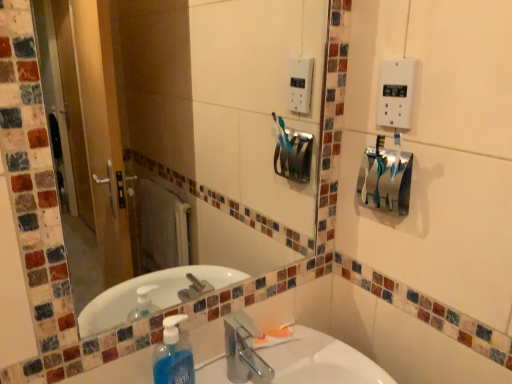
Question: Is white glossy sink at lower center further to the viewer compared to translucent orange tube at sink?

Choices:
 (A) yes
 (B) no

Answer: (B)

Question: Is white glossy sink at lower center oriented towards translucent orange tube at sink?

Choices:
 (A) yes
 (B) no

Answer: (B)

Question: Is white glossy sink at lower center positioned in front of translucent orange tube at sink?

Choices:
 (A) yes
 (B) no

Answer: (A)

Question: From the image's perspective, does white glossy sink at lower center appear higher than translucent orange tube at sink?

Choices:
 (A) yes
 (B) no

Answer: (B)

Question: Is white glossy sink at lower center looking in the opposite direction of translucent orange tube at sink?

Choices:
 (A) yes
 (B) no

Answer: (A)

Question: Is blue translucent liquid soap at lower left bigger or smaller than white plastic light switch at upper right?

Choices:
 (A) big
 (B) small

Answer: (A)

Question: From a real-world perspective, is blue translucent liquid soap at lower left above or below white plastic light switch at upper right?

Choices:
 (A) above
 (B) below

Answer: (B)

Question: From the image's perspective, is blue translucent liquid soap at lower left located above or below white plastic light switch at upper right?

Choices:
 (A) above
 (B) below

Answer: (B)

Question: Is point (182, 314) closer or farther from the camera than point (403, 61)?

Choices:
 (A) farther
 (B) closer

Answer: (A)

Question: Is clear glass mirror at upper center situated inside white plastic light switch at upper right or outside?

Choices:
 (A) inside
 (B) outside

Answer: (B)

Question: Does point (175, 144) appear closer or farther from the camera than point (395, 99)?

Choices:
 (A) closer
 (B) farther

Answer: (B)

Question: From a real-world perspective, relative to white plastic light switch at upper right, is clear glass mirror at upper center vertically above or below?

Choices:
 (A) above
 (B) below

Answer: (B)

Question: Is clear glass mirror at upper center taller or shorter than white plastic light switch at upper right?

Choices:
 (A) tall
 (B) short

Answer: (A)

Question: Considering the positions of point (206, 173) and point (282, 332), is point (206, 173) closer or farther from the camera than point (282, 332)?

Choices:
 (A) farther
 (B) closer

Answer: (A)

Question: Is clear glass mirror at upper center to the left or to the right of translucent orange tube at sink in the image?

Choices:
 (A) left
 (B) right

Answer: (A)